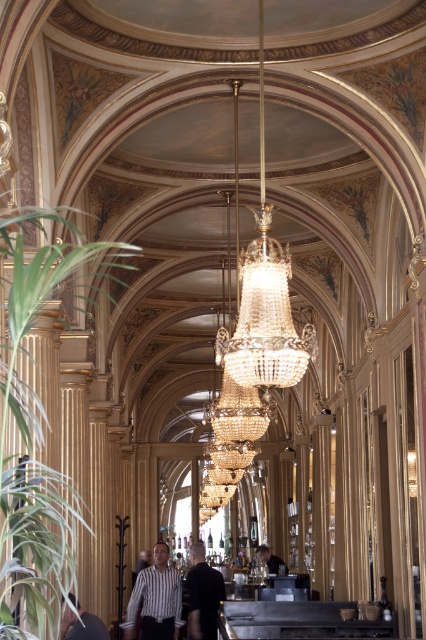
Is point (132, 620) closer to viewer compared to point (267, 566)?

Yes, point (132, 620) is closer to viewer.

Is point (158, 588) farther from camera compared to point (256, 552)?

That is False.

This screenshot has width=426, height=640. I want to click on striped fabric shirt at center, so click(155, 600).

How far apart are dark blue shirt at center and striped fabric shirt at lower left?

The distance of dark blue shirt at center from striped fabric shirt at lower left is 17.91 meters.

Can you confirm if dark blue shirt at center is positioned to the right of striped fabric shirt at lower left?

Indeed, dark blue shirt at center is positioned on the right side of striped fabric shirt at lower left.

Is point (195, 554) farther from camera compared to point (66, 627)?

Yes, it is.

At what (x,y) coordinates should I click in order to perform the action: click on dark blue shirt at center. Please return your answer as a coordinate pair (x, y). This screenshot has width=426, height=640. Looking at the image, I should click on (203, 595).

Does green leafy plant at left have a larger size compared to striped fabric shirt at lower left?

Yes, green leafy plant at left is bigger than striped fabric shirt at lower left.

Between point (2, 342) and point (63, 636), which one is positioned in front?

Point (2, 342) is more forward.

Is point (11, 212) less distant than point (78, 625)?

No, it is behind (78, 625).

At what (x,y) coordinates should I click in order to perform the action: click on green leafy plant at left. Please return your answer as a coordinate pair (x, y). The image size is (426, 640). Looking at the image, I should click on 36,432.